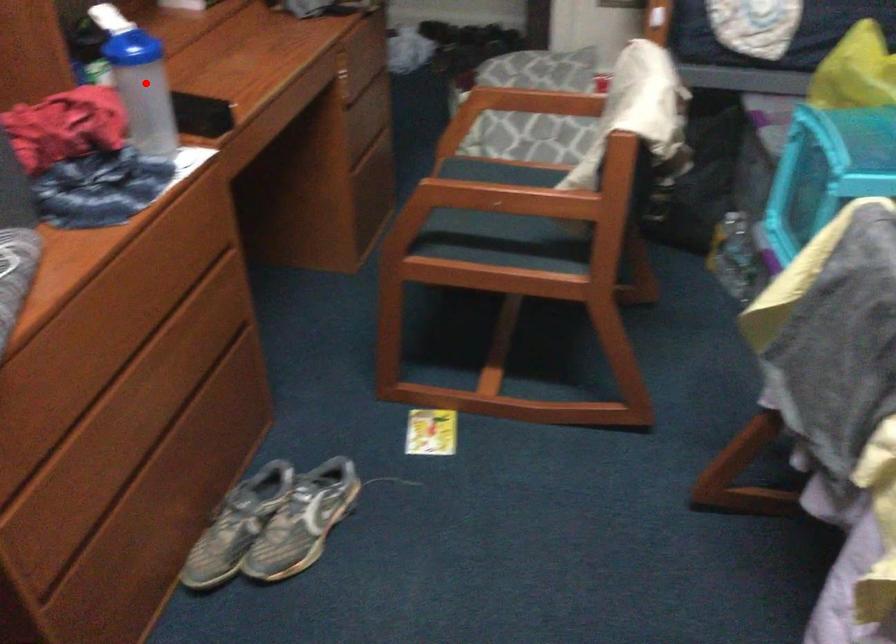
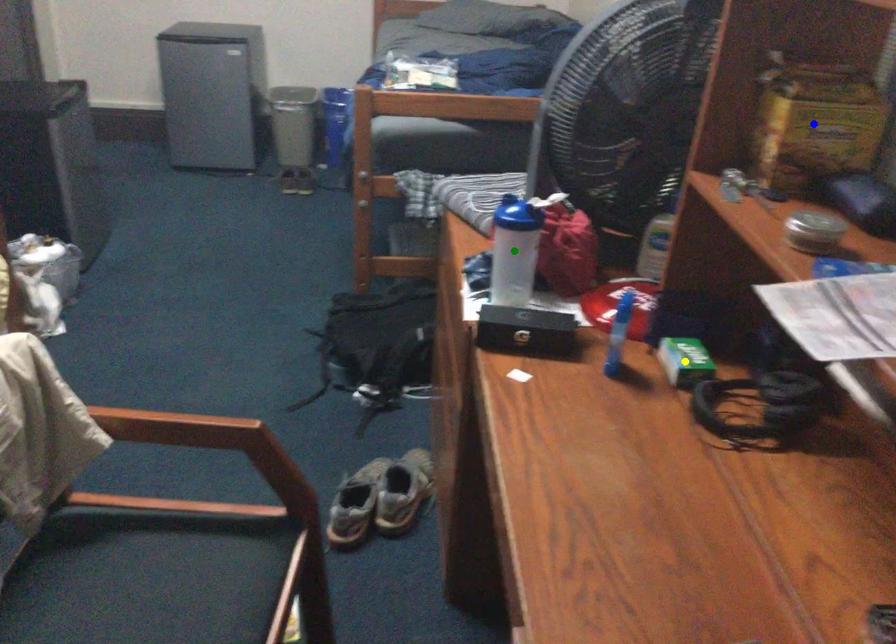
Question: I am providing you with two images of the same scene from different viewpoints. A red point is marked on the first image. You are given multiple points on the second image. Which point in image 2 is actually the same real-world point as the red point in image 1?

Choices:
 (A) blue point
 (B) green point
 (C) yellow point

Answer: (B)